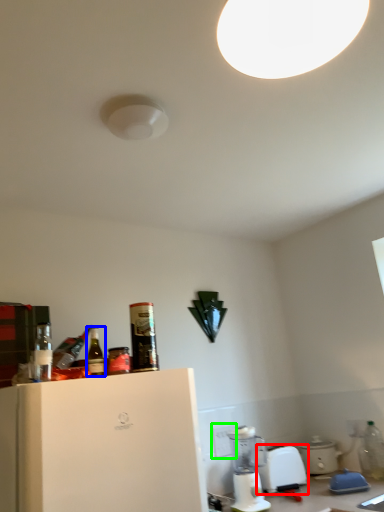
Question: Estimate the real-world distances between objects in this image. Which object is farther from kitchen appliance (highlighted by a red box), bottle (highlighted by a blue box) or electric outlet (highlighted by a green box)?

Choices:
 (A) bottle
 (B) electric outlet

Answer: (A)